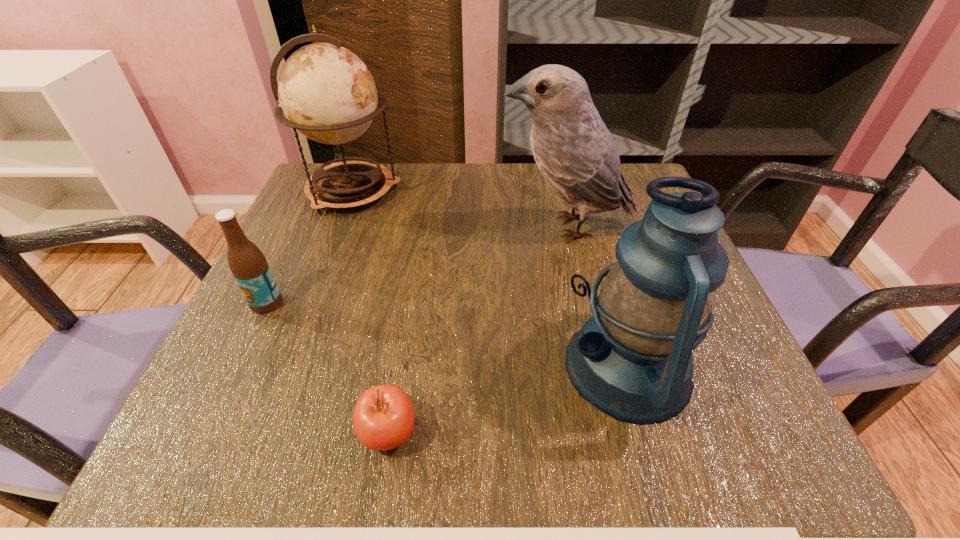
Identify the location of free space between the lantern and the parrot. This screenshot has height=540, width=960. (597, 297).

Find the location of a particular element. Image resolution: width=960 pixels, height=540 pixels. empty location between the parrot and the globe is located at coordinates 460,209.

Select which object is the second closest to the beer bottle. Please provide its 2D coordinates. Your answer should be formatted as a tuple, i.e. [(x, y)], where the tuple contains the x and y coordinates of a point satisfying the conditions above.

[(383, 418)]

Identify which object is located as the second nearest to the fourth tallest object. Please provide its 2D coordinates. Your answer should be formatted as a tuple, i.e. [(x, y)], where the tuple contains the x and y coordinates of a point satisfying the conditions above.

[(383, 418)]

This screenshot has width=960, height=540. What are the coordinates of `vacant point that satisfies the following two spatial constraints: 1. at the center of the globe; 2. on the back side of the shortest object` in the screenshot? It's located at tap(262, 433).

I want to click on free space that satisfies the following two spatial constraints: 1. at the center of the globe; 2. on the front side of the fourth tallest object, so click(x=311, y=303).

This screenshot has height=540, width=960. I want to click on vacant space that satisfies the following two spatial constraints: 1. on the back side of the apple; 2. at the center of the globe, so click(x=426, y=191).